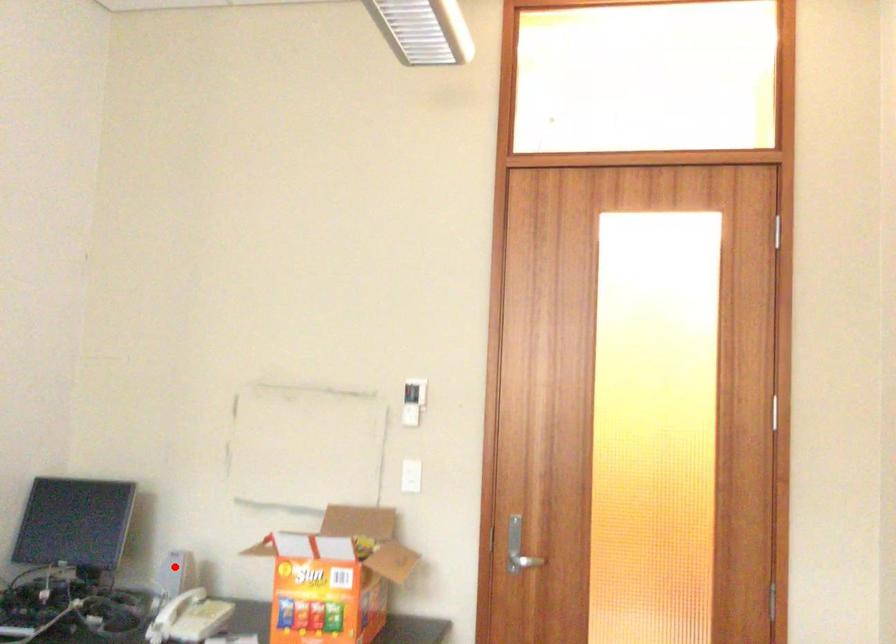
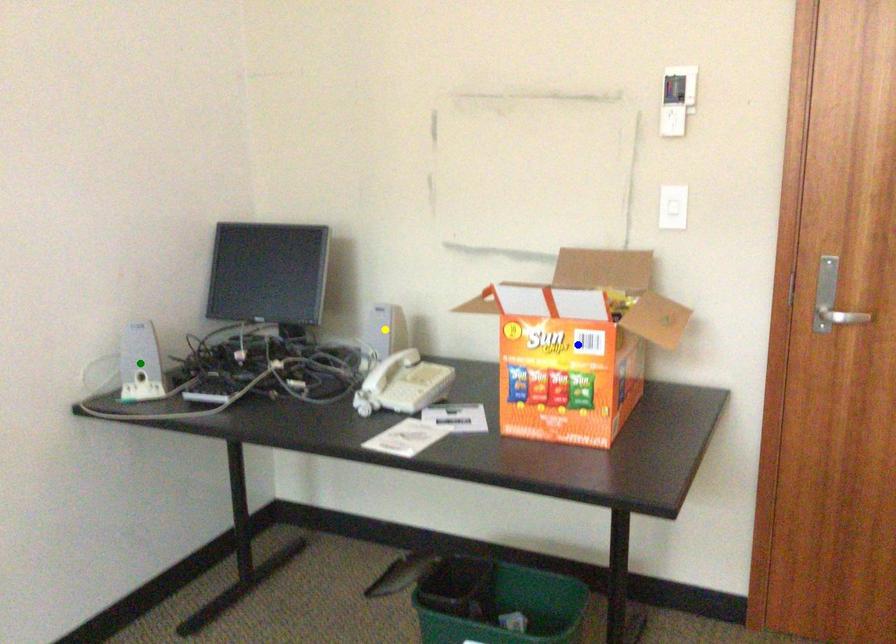
Question: I am providing you with two images of the same scene from different viewpoints. A red point is marked on the first image. You are given multiple points on the second image. In image 2, which mark is for the same physical point as the one in image 1?

Choices:
 (A) green point
 (B) yellow point
 (C) blue point

Answer: (B)